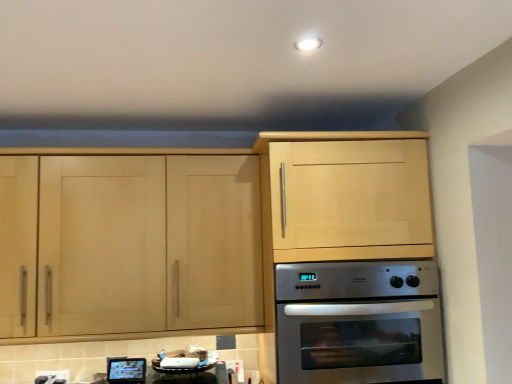
Question: Considering the positions of metallic silver tv at lower left and light wood cabinet at left in the image, is metallic silver tv at lower left wider or thinner than light wood cabinet at left?

Choices:
 (A) wide
 (B) thin

Answer: (B)

Question: Considering the positions of metallic silver tv at lower left and light wood cabinet at left in the image, is metallic silver tv at lower left taller or shorter than light wood cabinet at left?

Choices:
 (A) tall
 (B) short

Answer: (B)

Question: Which object is positioned farthest from the metallic silver tv at lower left?

Choices:
 (A) white plastic electric outlet at lower left
 (B) stainless steel oven at lower center
 (C) light wood cabinet at left

Answer: (B)

Question: Which of these objects is positioned closest to the light wood cabinet at left?

Choices:
 (A) stainless steel oven at lower center
 (B) white plastic electric outlet at lower left
 (C) metallic silver tv at lower left

Answer: (A)